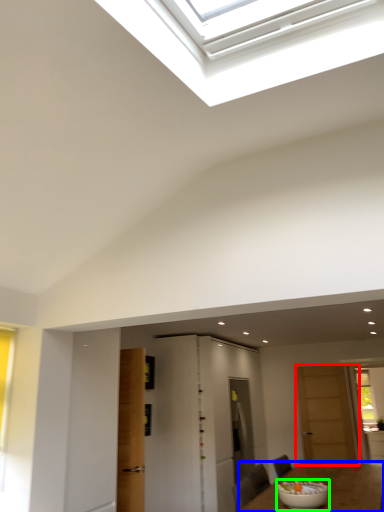
Question: Based on their relative distances, which object is farther from door (highlighted by a red box)? Choose from table (highlighted by a blue box) and bowl (highlighted by a green box).

Choices:
 (A) table
 (B) bowl

Answer: (B)